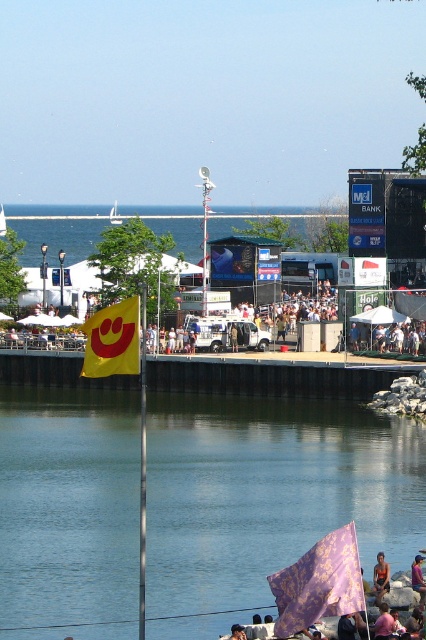
In the scene shown: You are standing at the center of the waterfront scene and want to walk to the purple damask fabric at lower right. Which direction should you move relative to the blue water at lower left?

To reach the purple damask fabric at lower right from the blue water at lower left, you should move to the right since the blue water at lower left is positioned on the left side of the purple damask fabric at lower right.

Looking at this image, you are a photographer standing at the waterfront scene. You want to take a photo that includes both the transparent water at lower center and the metallic blue scoreboard at upper right. Which object will appear larger in the photo?

The transparent water at lower center will appear larger in the photo because it is closer to the viewer than the metallic blue scoreboard at upper right.